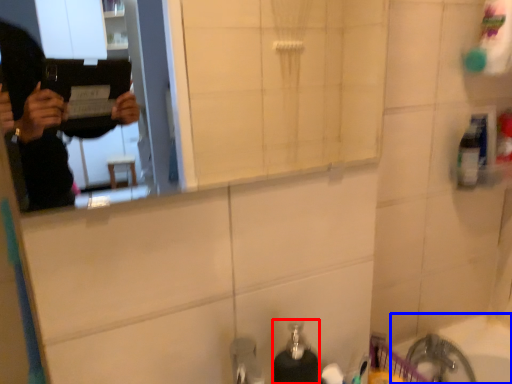
Question: Which of the following is the farthest to the observer, soap dispenser (highlighted by a red box) or bath (highlighted by a blue box)?

Choices:
 (A) soap dispenser
 (B) bath

Answer: (B)